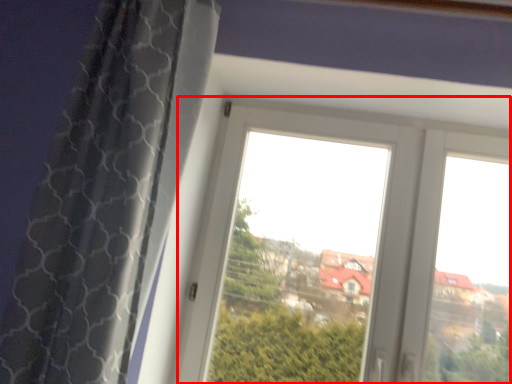
Question: From the image's perspective, what is the correct spatial relationship of window (annotated by the red box) in relation to curtain?

Choices:
 (A) below
 (B) above

Answer: (A)